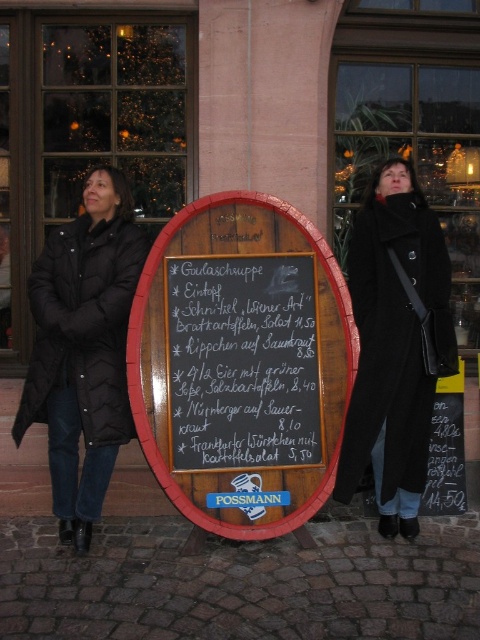
Question: Which point is closer to the camera taking this photo?

Choices:
 (A) (97, 497)
 (B) (208, 310)
 (C) (362, 380)

Answer: (B)

Question: Which object is closer to the camera taking this photo?

Choices:
 (A) black puffer coat at left
 (B) black wool coat at center

Answer: (A)

Question: Does black chalkboard menu at center have a smaller size compared to black wool coat at center?

Choices:
 (A) no
 (B) yes

Answer: (B)

Question: Is black wool coat at center thinner than black puffer coat at left?

Choices:
 (A) no
 (B) yes

Answer: (B)

Question: Which object is closer to the camera taking this photo?

Choices:
 (A) black chalkboard menu at center
 (B) black puffer coat at left

Answer: (B)

Question: Does black chalkboard menu at center appear on the right side of black wool coat at center?

Choices:
 (A) no
 (B) yes

Answer: (A)